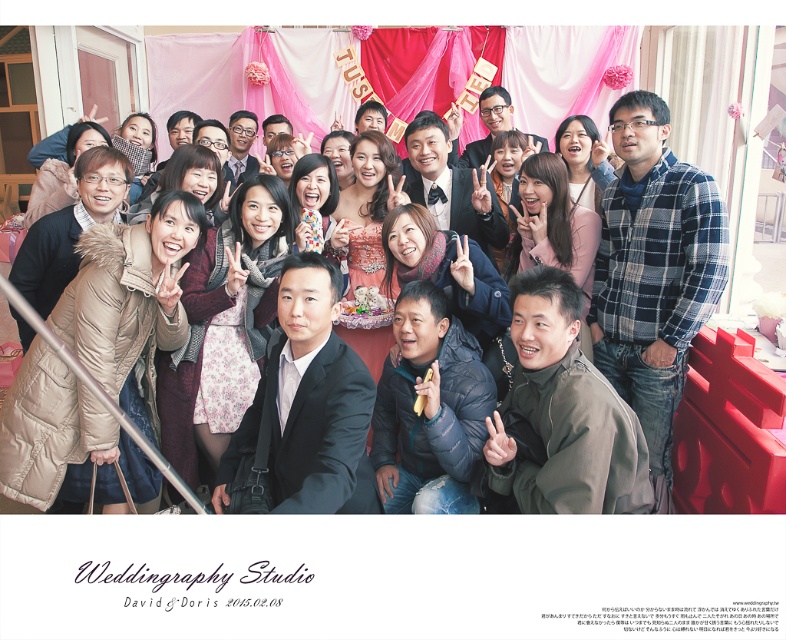
Which of these two, matte black jacket at center or matte black dress at center, stands shorter?

matte black dress at center

The height and width of the screenshot is (640, 786). What do you see at coordinates (68, 228) in the screenshot?
I see `matte black jacket at center` at bounding box center [68, 228].

Is point (120, 172) farther from viewer compared to point (469, 180)?

No, (120, 172) is closer to viewer.

Identify the location of matte black jacket at center. The height and width of the screenshot is (640, 786). (68, 228).

Does point (636, 212) lie in front of point (39, 236)?

Yes.

Who is lower down, blue plaid shirt at center or matte black jacket at center?

blue plaid shirt at center

Is point (645, 422) farther from camera compared to point (35, 272)?

No, (645, 422) is closer to viewer.

Identify the location of blue plaid shirt at center. (652, 273).

Who is shorter, blue plaid shirt at center or matte black dress at center?

With less height is matte black dress at center.

Between blue plaid shirt at center and matte black dress at center, which one is positioned higher?

matte black dress at center

I want to click on blue plaid shirt at center, so (x=652, y=273).

Where is `blue plaid shirt at center`? The width and height of the screenshot is (786, 640). blue plaid shirt at center is located at coordinates (652, 273).